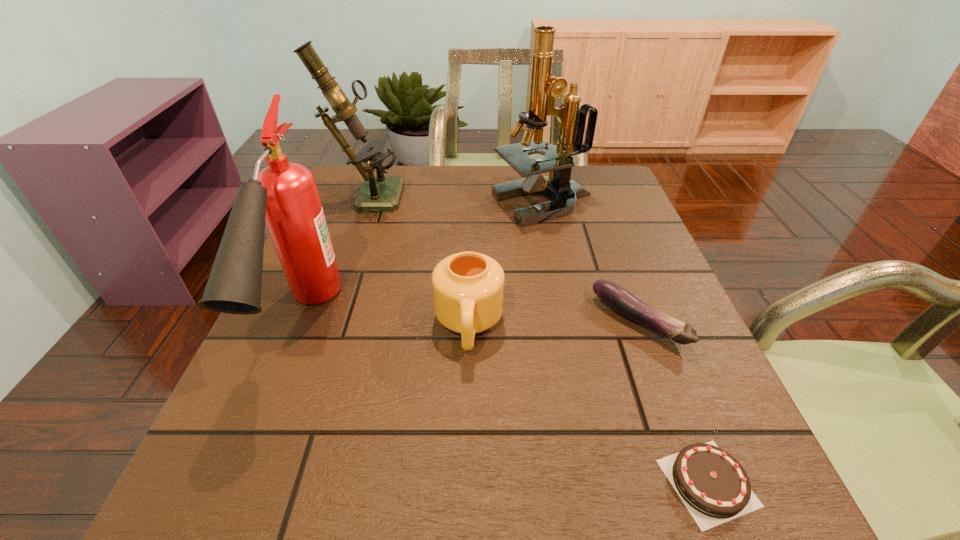
Find the location of a particular element. free space located 0.330m at the eyepiece of the left microscope is located at coordinates (527, 194).

At what (x,y) coordinates should I click in order to perform the action: click on blank space located 0.050m at the nozzle of the fire extinguisher. Please return your answer as a coordinate pair (x, y). The height and width of the screenshot is (540, 960). Looking at the image, I should click on (258, 435).

Image resolution: width=960 pixels, height=540 pixels. I want to click on free region located 0.250m on the handle side of the third shortest object, so click(x=464, y=519).

I want to click on free space located 0.050m on the back of the second shortest object, so click(621, 276).

Image resolution: width=960 pixels, height=540 pixels. Identify the location of vacant space positioned on the back of the shortest object. (657, 350).

Where is `object that is positioned at the near edge`? object that is positioned at the near edge is located at coordinates (715, 488).

This screenshot has width=960, height=540. Identify the location of microscope present at the left edge. (382, 193).

Where is `fire extinguisher present at the left edge`? The height and width of the screenshot is (540, 960). fire extinguisher present at the left edge is located at coordinates (284, 195).

The height and width of the screenshot is (540, 960). In order to click on microscope present at the right edge in this screenshot , I will do `click(544, 87)`.

Identify the location of eggplant present at the right edge. (616, 297).